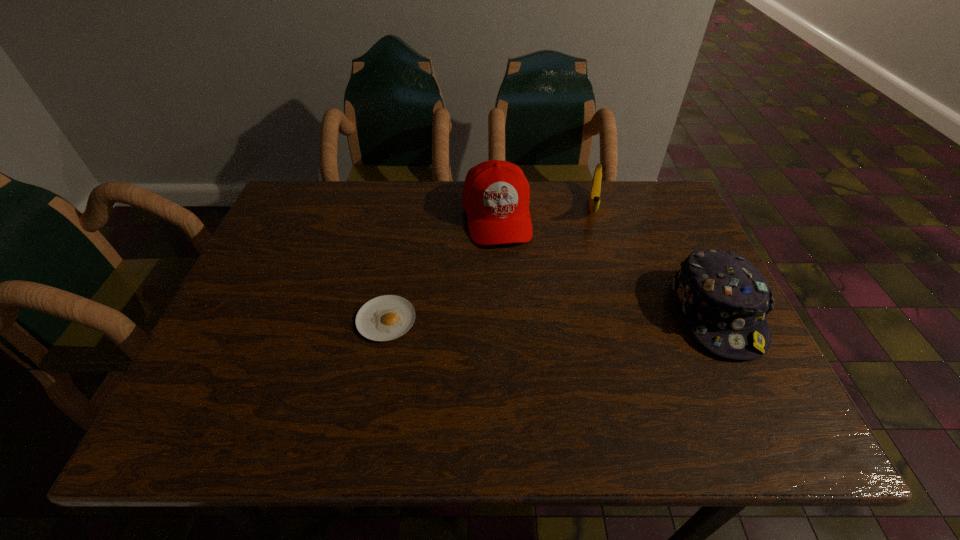
Locate an element on the screen. This screenshot has width=960, height=540. vacant area between the second shortest object and the headwear is located at coordinates (655, 259).

Image resolution: width=960 pixels, height=540 pixels. What are the coordinates of `vacant space in between the leftmost object and the second tallest object` in the screenshot? It's located at (551, 316).

I want to click on empty space that is in between the shortest object and the second shortest object, so click(490, 262).

Identify the location of vacant point located between the rightmost object and the tallest object. (607, 265).

Find the location of a particular element. The height and width of the screenshot is (540, 960). free space between the shortest object and the second object from right to left is located at coordinates (490, 262).

Identify which object is the second nearest to the rightmost object. Please provide its 2D coordinates. Your answer should be formatted as a tuple, i.e. [(x, y)], where the tuple contains the x and y coordinates of a point satisfying the conditions above.

[(496, 193)]

Identify the location of the second closest object to the second object from left to right. This screenshot has width=960, height=540. (384, 318).

Find the location of a particular element. This screenshot has height=540, width=960. vacant space that satisfies the following two spatial constraints: 1. on the back side of the baseball cap; 2. on the right side of the shortest object is located at coordinates (406, 216).

Where is `free point that satisfies the following two spatial constraints: 1. on the back side of the third object from right to left; 2. on the right side of the second object from right to left`? The width and height of the screenshot is (960, 540). free point that satisfies the following two spatial constraints: 1. on the back side of the third object from right to left; 2. on the right side of the second object from right to left is located at coordinates (495, 205).